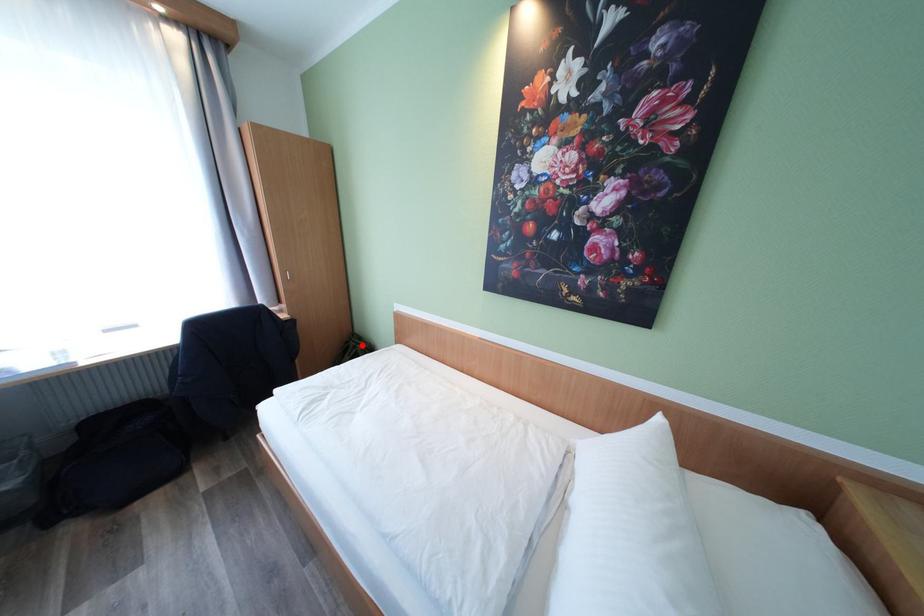
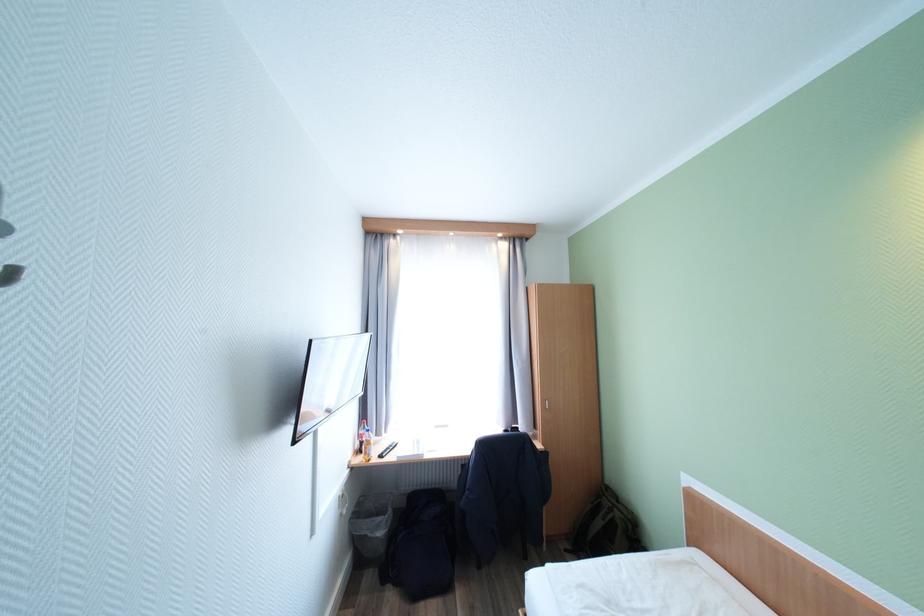
Find the pixel in the second image that matches the highlighted location in the first image.

(617, 506)